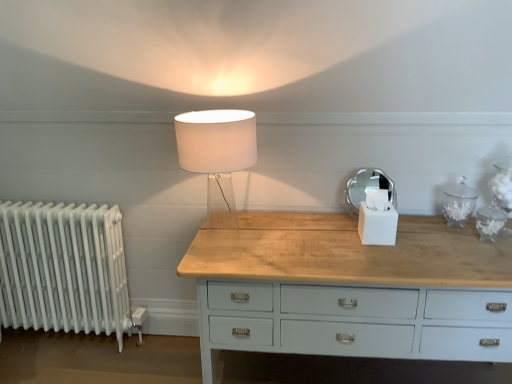
Question: From the image's perspective, is translucent glass lamp at center below white matte tissue box at center?

Choices:
 (A) yes
 (B) no

Answer: (B)

Question: Is the depth of translucent glass lamp at center greater than that of white matte tissue box at center?

Choices:
 (A) no
 (B) yes

Answer: (A)

Question: Is translucent glass lamp at center wider than white matte tissue box at center?

Choices:
 (A) no
 (B) yes

Answer: (B)

Question: Is translucent glass lamp at center thinner than white matte tissue box at center?

Choices:
 (A) yes
 (B) no

Answer: (B)

Question: Is translucent glass lamp at center next to white matte tissue box at center?

Choices:
 (A) yes
 (B) no

Answer: (B)

Question: Is translucent glass lamp at center positioned in front of white matte tissue box at center?

Choices:
 (A) no
 (B) yes

Answer: (B)

Question: Could you tell me if white matte tissue box at center is facing white metallic radiator at left?

Choices:
 (A) yes
 (B) no

Answer: (B)

Question: Is the position of white matte tissue box at center more distant than that of white metallic radiator at left?

Choices:
 (A) yes
 (B) no

Answer: (B)

Question: Is white matte tissue box at center turned away from white metallic radiator at left?

Choices:
 (A) no
 (B) yes

Answer: (A)

Question: Can you see white matte tissue box at center touching white metallic radiator at left?

Choices:
 (A) no
 (B) yes

Answer: (A)

Question: From a real-world perspective, is white matte tissue box at center over white metallic radiator at left?

Choices:
 (A) no
 (B) yes

Answer: (B)

Question: Does white matte tissue box at center have a lesser width compared to white metallic radiator at left?

Choices:
 (A) yes
 (B) no

Answer: (A)

Question: Is white metallic radiator at left not inside translucent glass lamp at center?

Choices:
 (A) no
 (B) yes

Answer: (B)